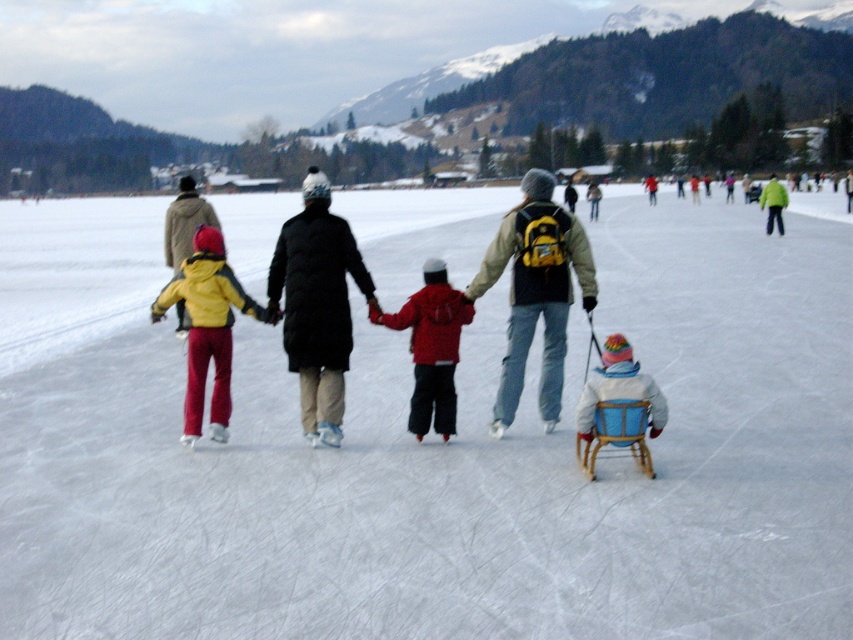
Looking at this image, who is shorter, black puffy coat at center or red matte jacket at center?

red matte jacket at center

Find the location of a particular element. This screenshot has width=853, height=640. black puffy coat at center is located at coordinates (317, 305).

Does white smooth ice at center lie in front of yellow matte jacket at left?

Yes, it is in front of yellow matte jacket at left.

Does white smooth ice at center appear over yellow matte jacket at left?

Yes.

Who is more distant from viewer, (345, 515) or (222, 284)?

The point (222, 284) is behind.

The width and height of the screenshot is (853, 640). Find the location of `white smooth ice at center`. white smooth ice at center is located at coordinates (463, 468).

Does white smooth ice at center appear on the left side of matte black jacket at center?

Indeed, white smooth ice at center is positioned on the left side of matte black jacket at center.

Does white smooth ice at center have a greater width compared to matte black jacket at center?

Yes.

From the picture: Who is more distant from viewer, (341,465) or (550,292)?

Point (550,292)

Where is `white smooth ice at center`? Image resolution: width=853 pixels, height=640 pixels. white smooth ice at center is located at coordinates (463, 468).